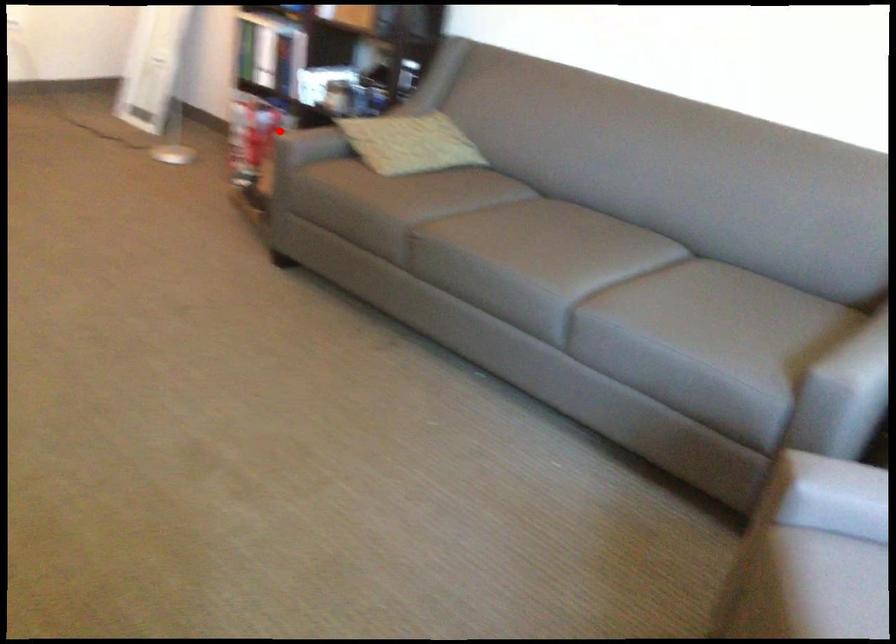
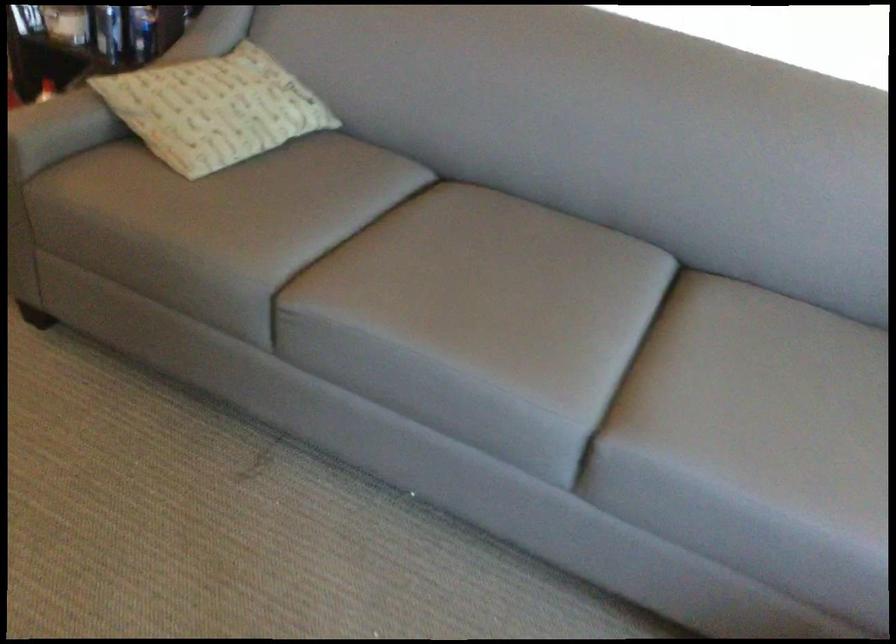
Question: A red point is marked in image1. In image2, is the corresponding 3D point closer to the camera or farther? Reply with the corresponding letter.

Choices:
 (A) The corresponding 3D point is closer.
 (B) The corresponding 3D point is farther.

Answer: (A)